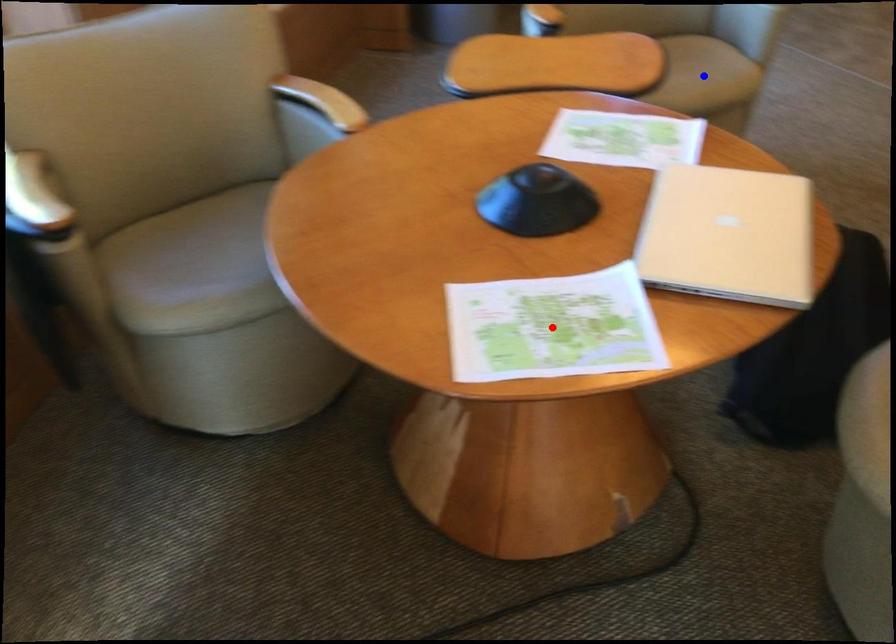
Question: Which of the two points in the image is closer to the camera?

Choices:
 (A) Blue point is closer.
 (B) Red point is closer.

Answer: (B)